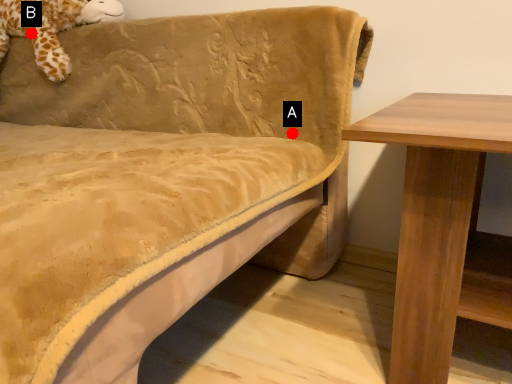
Question: Two points are circled on the image, labeled by A and B beside each circle. Which point appears farthest from the camera in this image?

Choices:
 (A) A is further
 (B) B is further

Answer: (B)